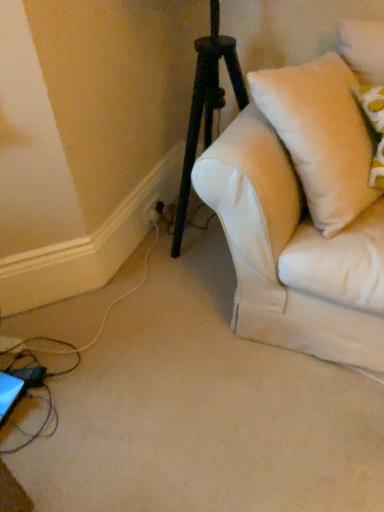
Question: Is white soft pillow at upper right not within white plastic electric outlet at lower left?

Choices:
 (A) no
 (B) yes

Answer: (B)

Question: From a real-world perspective, does white soft pillow at upper right stand above white plastic electric outlet at lower left?

Choices:
 (A) yes
 (B) no

Answer: (A)

Question: Could you tell me if white soft pillow at upper right is turned towards white plastic electric outlet at lower left?

Choices:
 (A) yes
 (B) no

Answer: (B)

Question: Considering the relative positions of white soft pillow at upper right and white plastic electric outlet at lower left in the image provided, is white soft pillow at upper right to the right of white plastic electric outlet at lower left from the viewer's perspective?

Choices:
 (A) no
 (B) yes

Answer: (B)

Question: Does white soft pillow at upper right lie in front of white plastic electric outlet at lower left?

Choices:
 (A) yes
 (B) no

Answer: (A)

Question: Is white soft pillow at upper right looking in the opposite direction of white plastic electric outlet at lower left?

Choices:
 (A) yes
 (B) no

Answer: (A)

Question: From a real-world perspective, is white plastic electric outlet at lower left on top of white soft pillow at upper right?

Choices:
 (A) yes
 (B) no

Answer: (B)

Question: Is white plastic electric outlet at lower left bigger than white soft pillow at upper right?

Choices:
 (A) yes
 (B) no

Answer: (B)

Question: Is white plastic electric outlet at lower left smaller than white soft pillow at upper right?

Choices:
 (A) yes
 (B) no

Answer: (A)

Question: Is white plastic electric outlet at lower left shorter than white soft pillow at upper right?

Choices:
 (A) yes
 (B) no

Answer: (A)

Question: Would you say white plastic electric outlet at lower left is outside white soft pillow at upper right?

Choices:
 (A) yes
 (B) no

Answer: (A)

Question: Is white soft pillow at upper right located within white plastic electric outlet at lower left?

Choices:
 (A) no
 (B) yes

Answer: (A)

Question: Would you say white plastic electric outlet at lower left is inside or outside white soft pillow at upper right?

Choices:
 (A) outside
 (B) inside

Answer: (A)